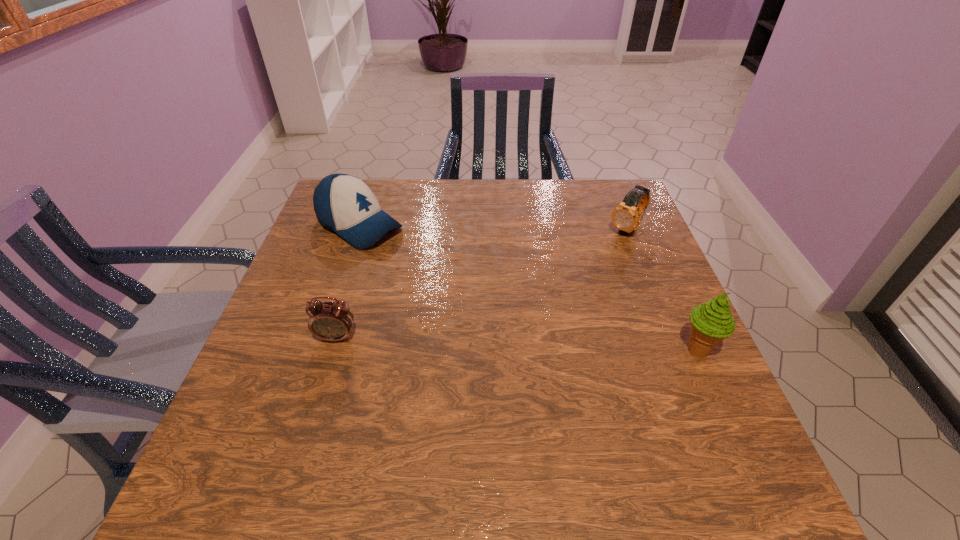
Where is `free location located 0.340m on the face of the watch`? Image resolution: width=960 pixels, height=540 pixels. free location located 0.340m on the face of the watch is located at coordinates (550, 309).

Image resolution: width=960 pixels, height=540 pixels. I want to click on free spot located 0.290m on the face of the watch, so click(x=562, y=297).

You are a GUI agent. You are given a task and a screenshot of the screen. Output one action in this format:
    pyautogui.click(x=<x>, y=<y>)
    Task: Click on the baseball cap at the far edge
    This screenshot has width=960, height=540.
    Given the screenshot: What is the action you would take?
    pyautogui.click(x=343, y=203)

Where is `watch at the far edge`? watch at the far edge is located at coordinates (626, 216).

The image size is (960, 540). What are the coordinates of `alarm clock at the left edge` in the screenshot? It's located at (332, 321).

The image size is (960, 540). Find the location of `baseball cap that is positioned at the left edge`. baseball cap that is positioned at the left edge is located at coordinates tap(343, 203).

At what (x,y) coordinates should I click in order to perform the action: click on icecream that is at the right edge. Please return your answer as a coordinate pair (x, y). Image resolution: width=960 pixels, height=540 pixels. Looking at the image, I should click on (712, 322).

Where is `watch located at the right edge`? Image resolution: width=960 pixels, height=540 pixels. watch located at the right edge is located at coordinates (626, 216).

Where is `object at the far left corner`? This screenshot has width=960, height=540. object at the far left corner is located at coordinates (343, 203).

Locate an element on the screen. object that is at the far right corner is located at coordinates (626, 216).